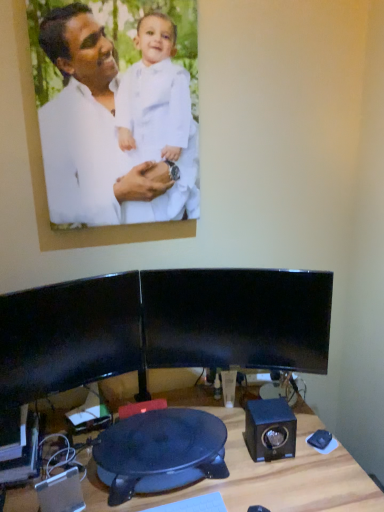
Where is `vacant area located to the right-hand side of black plastic swivel chair at center`? vacant area located to the right-hand side of black plastic swivel chair at center is located at coordinates (271, 464).